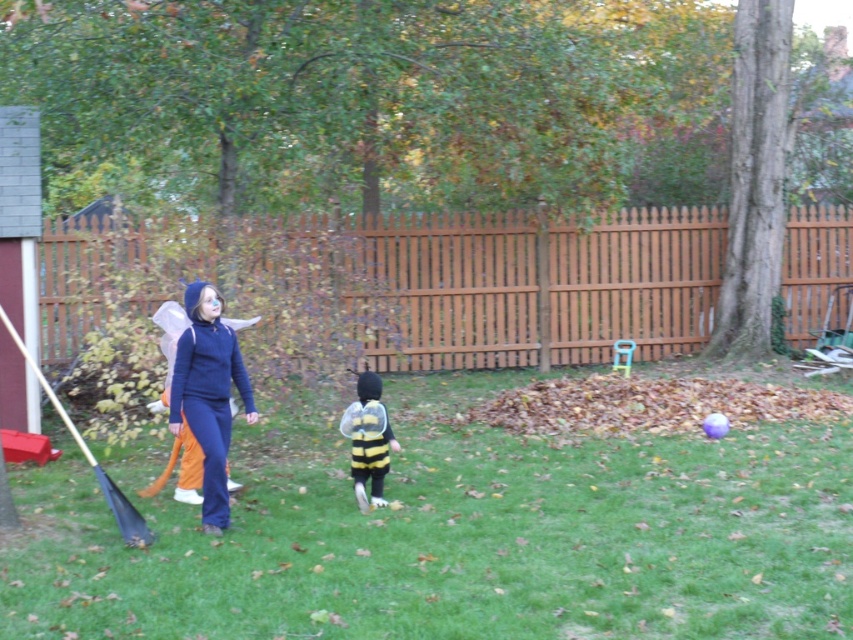
Question: Which point is closer to the camera?

Choices:
 (A) black plastic shovel at left
 (B) blue fleece jacket at center

Answer: (A)

Question: Which object is closer to the camera taking this photo?

Choices:
 (A) black plastic shovel at left
 (B) green grass at center
 (C) yellow and black fabric bee costume at center

Answer: (B)

Question: From the image, what is the correct spatial relationship of blue fleece jacket at center in relation to yellow and black fabric bee costume at center?

Choices:
 (A) above
 (B) below

Answer: (A)

Question: From the image, what is the correct spatial relationship of yellow and black fabric bee costume at center in relation to black plastic shovel at left?

Choices:
 (A) above
 (B) below

Answer: (B)

Question: Is yellow and black fabric bee costume at center below black plastic shovel at left?

Choices:
 (A) yes
 (B) no

Answer: (A)

Question: Estimate the real-world distances between objects in this image. Which object is farther from the green grass at center?

Choices:
 (A) blue fleece jacket at center
 (B) yellow and black fabric bee costume at center

Answer: (B)